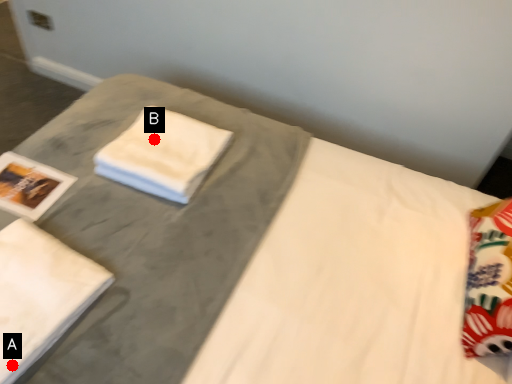
Question: Two points are circled on the image, labeled by A and B beside each circle. Which point is farther from the camera taking this photo?

Choices:
 (A) A is further
 (B) B is further

Answer: (B)